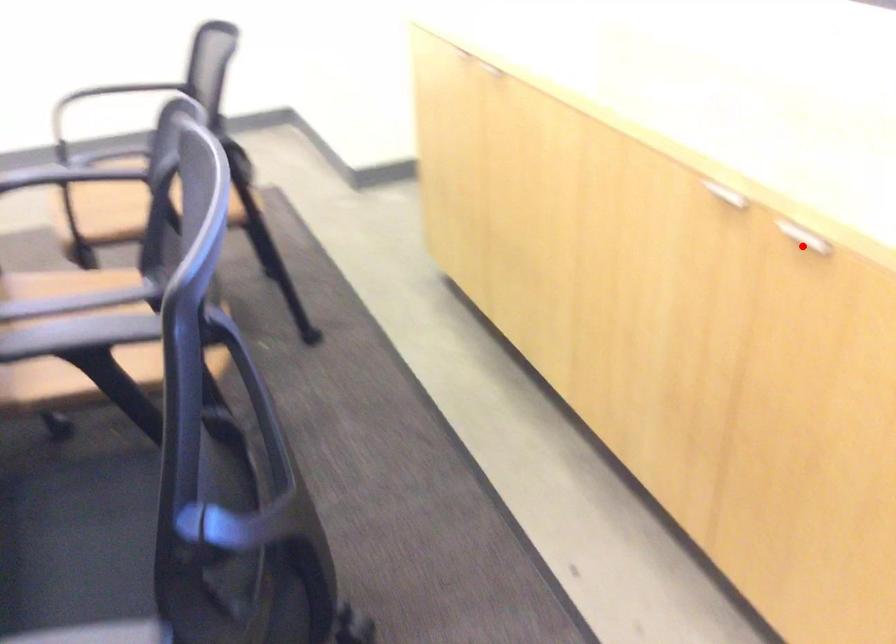
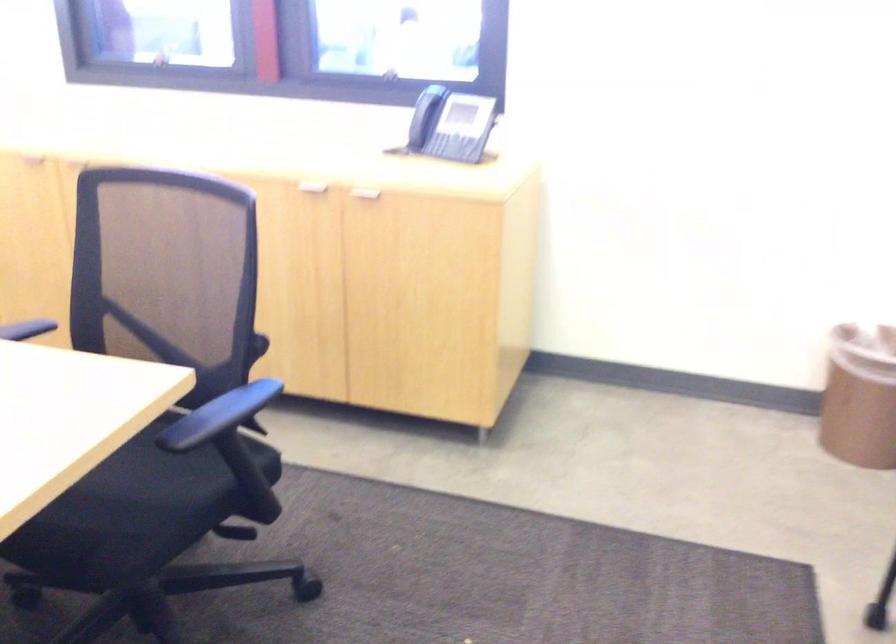
Question: A red point is marked in image1. In image2, is the corresponding 3D point closer to the camera or farther? Reply with the corresponding letter.

Choices:
 (A) The corresponding 3D point is closer.
 (B) The corresponding 3D point is farther.

Answer: (B)